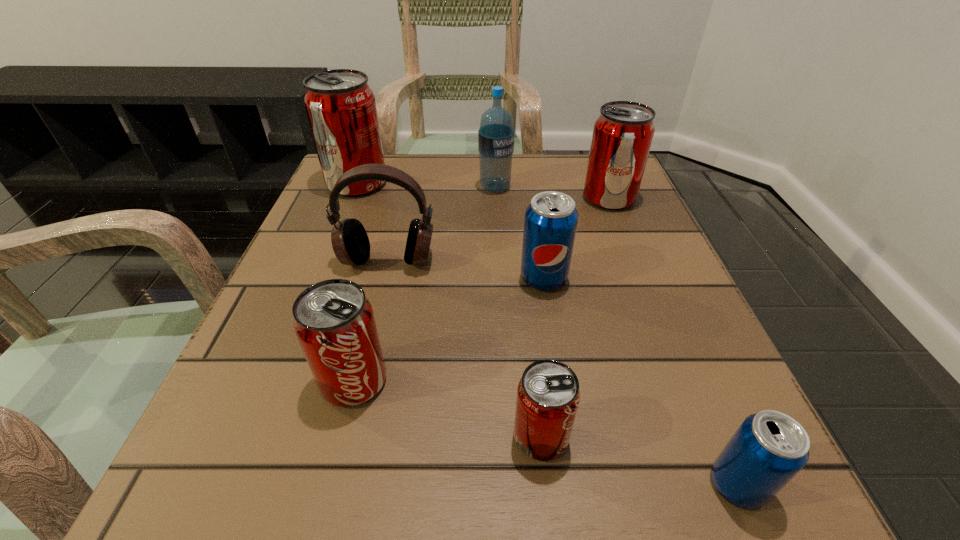
Where is `the biggest red pop soda`? the biggest red pop soda is located at coordinates (340, 105).

At what (x,y) coordinates should I click in order to perform the action: click on blue water bottle. Please return your answer as a coordinate pair (x, y). The image size is (960, 540). Looking at the image, I should click on (496, 134).

You are a GUI agent. You are given a task and a screenshot of the screen. Output one action in this format:
    pyautogui.click(x=<x>, y=<y>)
    Task: Click on the second tallest pop soda
    The width and height of the screenshot is (960, 540).
    Given the screenshot: What is the action you would take?
    pyautogui.click(x=623, y=133)

The height and width of the screenshot is (540, 960). I want to click on the third smallest red pop soda, so click(623, 133).

At what (x,y) coordinates should I click in order to perform the action: click on headset. Please return your answer as a coordinate pair (x, y). Looking at the image, I should click on (350, 242).

At what (x,y) coordinates should I click in order to perform the action: click on the third farthest pop soda. Please return your answer as a coordinate pair (x, y). This screenshot has width=960, height=540. Looking at the image, I should click on (550, 223).

At what (x,y) coordinates should I click in order to perform the action: click on the bigger blue pop soda. Please return your answer as a coordinate pair (x, y). Image resolution: width=960 pixels, height=540 pixels. Looking at the image, I should click on (550, 223).

This screenshot has width=960, height=540. I want to click on the third nearest pop soda, so click(334, 322).

Locate an element on the screen. the second smallest red pop soda is located at coordinates (334, 322).

This screenshot has height=540, width=960. In order to click on the right blue pop soda in this screenshot , I will do `click(769, 448)`.